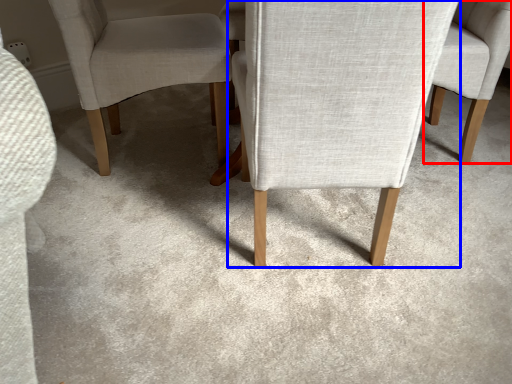
Question: Which object appears farthest to the camera in this image, chair (highlighted by a red box) or chair (highlighted by a blue box)?

Choices:
 (A) chair
 (B) chair

Answer: (A)